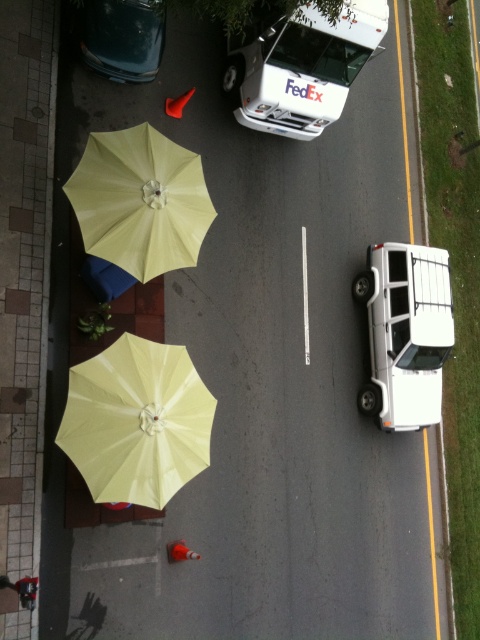
You are a delivery person trying to park your white matte fedex van at upper center near the yellow fabric umbrella at lower left. Considering their heights, will the van fit under the umbrella without touching it?

The yellow fabric umbrella at lower left is much taller than the white matte fedex van at upper center. Therefore, the van can fit under the umbrella without touching it since the umbrella extends higher than the van.